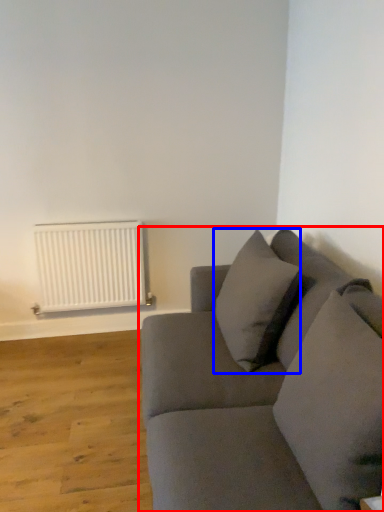
Question: Which object appears closest to the camera in this image, studio couch (highlighted by a red box) or pillow (highlighted by a blue box)?

Choices:
 (A) studio couch
 (B) pillow

Answer: (A)